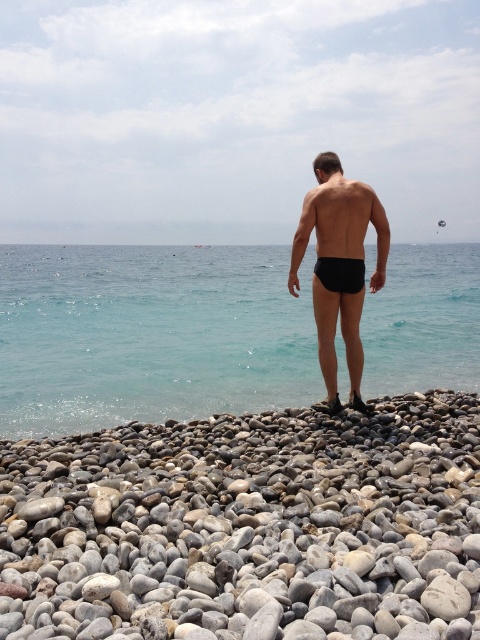
Which of these two, clear blue water at center or black matte shorts at center, stands shorter?

Standing shorter between the two is black matte shorts at center.

Between point (50, 353) and point (295, 241), which one is positioned in front?

Point (295, 241)

Image resolution: width=480 pixels, height=640 pixels. Find the location of `clear blue water at center`. clear blue water at center is located at coordinates (149, 333).

Between smooth gray pebble at center and black matte shorts at center, which one is positioned lower?

smooth gray pebble at center is lower down.

Is smooth gray pebble at center smaller than black matte shorts at center?

Correct, smooth gray pebble at center occupies less space than black matte shorts at center.

Identify the location of smooth gray pebble at center. The width and height of the screenshot is (480, 640). (249, 525).

At what (x,y) coordinates should I click in order to perform the action: click on smooth gray pebble at center. Please return your answer as a coordinate pair (x, y). Looking at the image, I should click on (249, 525).

Find the location of a particular element. This screenshot has height=640, width=480. smooth gray pebble at center is located at coordinates (249, 525).

How much distance is there between smooth gray pebble at center and clear blue water at center?

smooth gray pebble at center and clear blue water at center are 33.59 feet apart from each other.

You are a GUI agent. You are given a task and a screenshot of the screen. Output one action in this format:
    pyautogui.click(x=<x>, y=<y>)
    Task: Click on the smooth gray pebble at center
    
    Given the screenshot: What is the action you would take?
    pyautogui.click(x=249, y=525)

At what (x,y) coordinates should I click in order to perform the action: click on smooth gray pebble at center. Please return your answer as a coordinate pair (x, y). The image size is (480, 640). Looking at the image, I should click on pos(249,525).